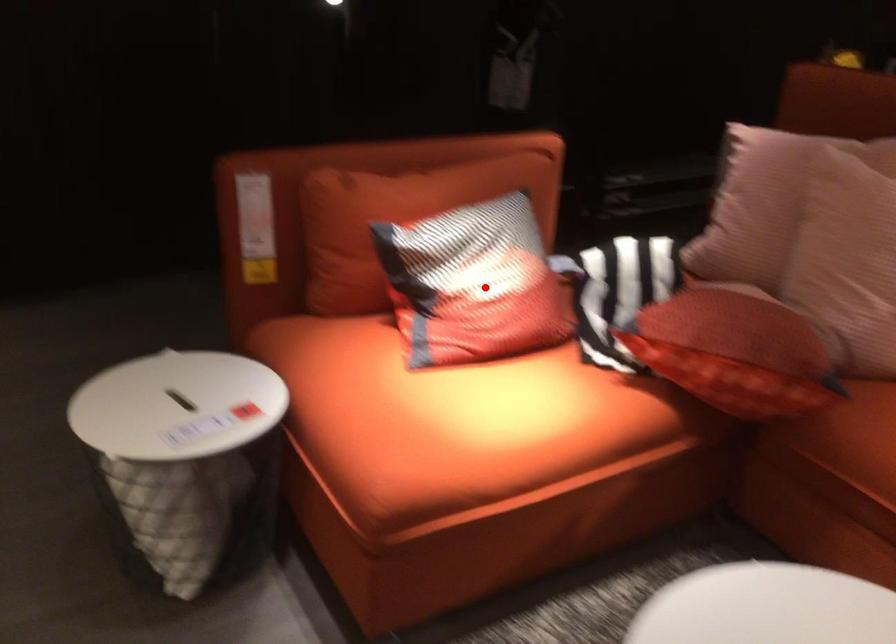
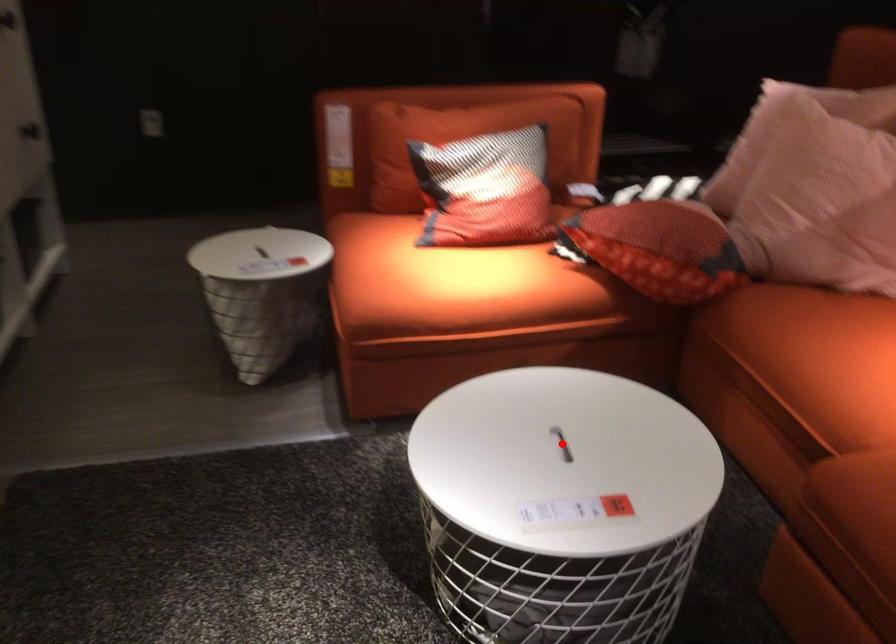
I am providing you with two images of the same scene from different viewpoints. A red point is marked on the first image and another point is marked on the second image. Is the marked point in image1 the same physical position as the marked point in image2?

No